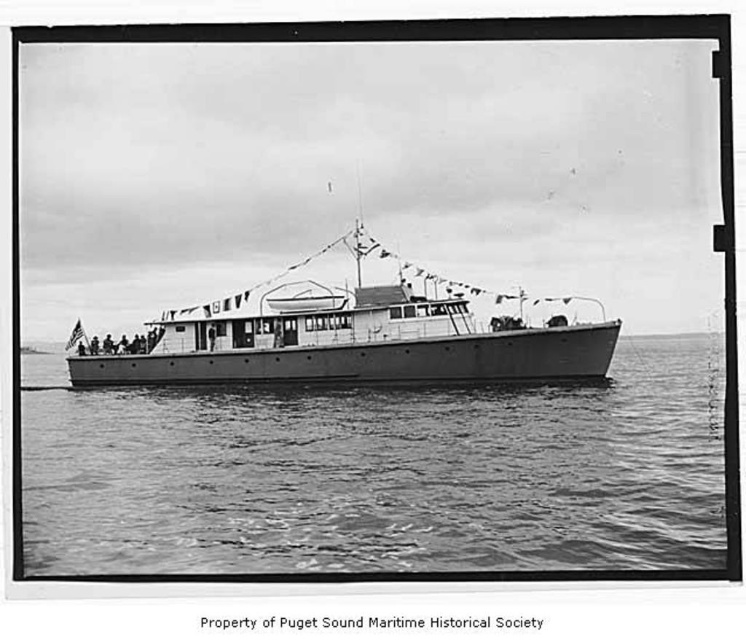
Question: Which point is farther from the camera taking this photo?

Choices:
 (A) (623, 506)
 (B) (410, 307)

Answer: (B)

Question: Is smooth water at center smaller than smooth metal boat at center?

Choices:
 (A) yes
 (B) no

Answer: (B)

Question: Is smooth water at center below smooth metal boat at center?

Choices:
 (A) no
 (B) yes

Answer: (B)

Question: Which of the following is the closest to the observer?

Choices:
 (A) (345, 422)
 (B) (150, 349)

Answer: (A)

Question: Does smooth water at center have a smaller size compared to smooth metal boat at center?

Choices:
 (A) yes
 (B) no

Answer: (B)